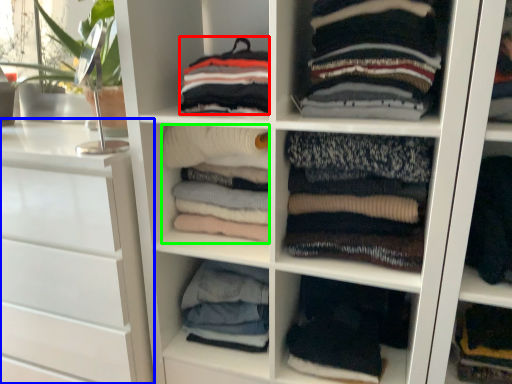
Question: Which is nearer to the clothing (highlighted by a red box)? chest of drawers (highlighted by a blue box) or clothing (highlighted by a green box).

Choices:
 (A) chest of drawers
 (B) clothing

Answer: (B)